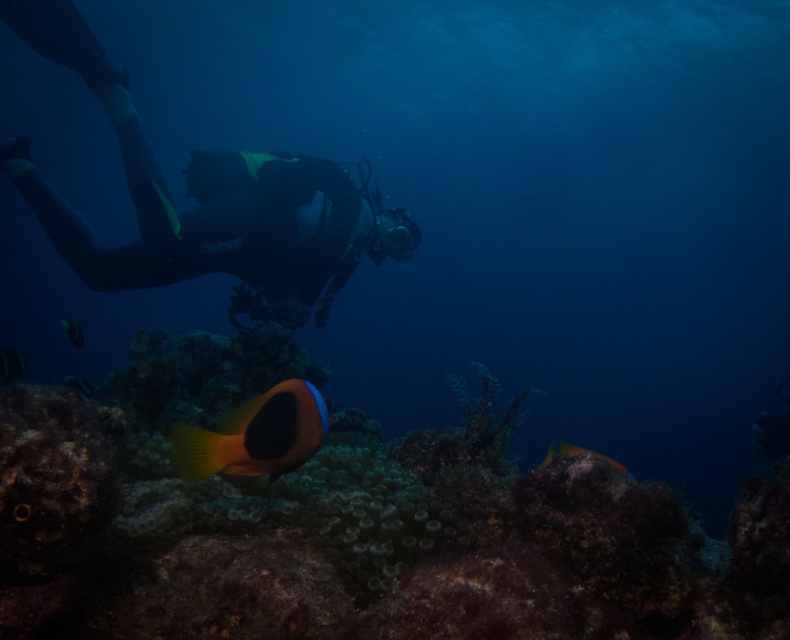
Question: Is orange matte fish at center closer to the viewer compared to orange matte fish at lower center?

Choices:
 (A) yes
 (B) no

Answer: (A)

Question: Which point is farther to the camera?

Choices:
 (A) (574, 444)
 (B) (339, 632)

Answer: (A)

Question: Can you confirm if translucent green coral reef at center is positioned to the right of black neoprene wetsuit at upper left?

Choices:
 (A) yes
 (B) no

Answer: (A)

Question: Which point appears farthest from the camera in this image?

Choices:
 (A) (266, 388)
 (B) (760, 497)
 (C) (250, 266)
 (D) (548, 452)

Answer: (C)

Question: Which of the following is the closest to the observer?

Choices:
 (A) (499, 484)
 (B) (68, 332)
 (C) (340, 195)

Answer: (A)

Question: Does black neoprene wetsuit at upper left appear over orange-yellow coral at center?

Choices:
 (A) yes
 (B) no

Answer: (A)